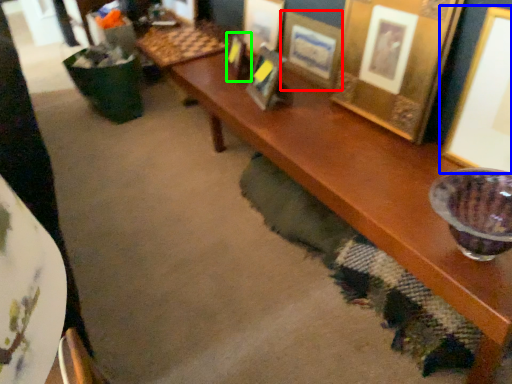
Question: Estimate the real-world distances between objects in this image. Which object is farther from picture frame (highlighted by a red box), picture frame (highlighted by a blue box) or picture frame (highlighted by a green box)?

Choices:
 (A) picture frame
 (B) picture frame

Answer: (A)